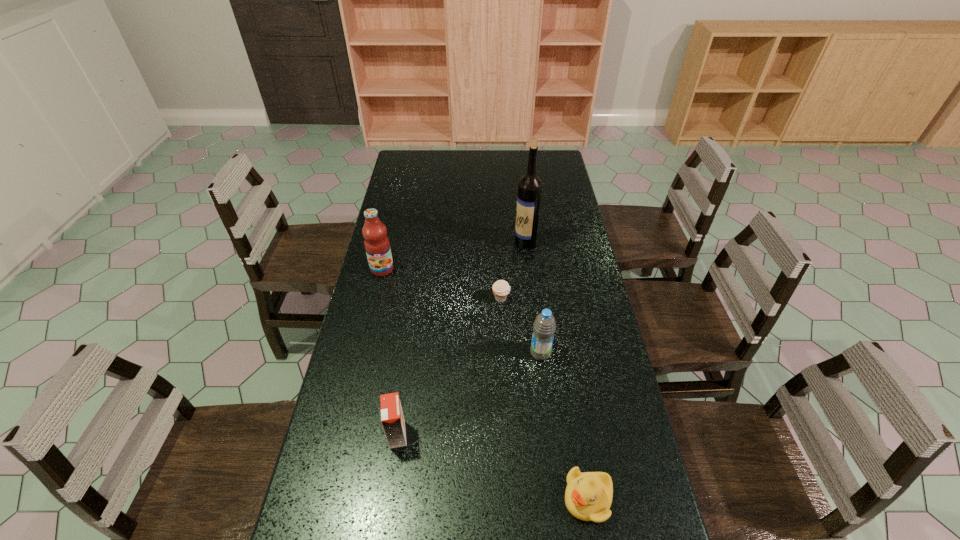
Locate an element on the screen. muffin is located at coordinates (501, 288).

What are the coordinates of `vacant area located 0.070m on the label of the farthest object` in the screenshot? It's located at (495, 242).

At what (x,y) coordinates should I click in order to perform the action: click on vacant space located 0.360m on the label of the farthest object. Please return your answer as a coordinate pair (x, y). The image size is (960, 540). Looking at the image, I should click on (419, 242).

Where is `blank space located 0.060m on the label of the farthest object`? This screenshot has width=960, height=540. blank space located 0.060m on the label of the farthest object is located at coordinates (498, 242).

This screenshot has width=960, height=540. I want to click on vacant region located 0.270m on the front label of the leftmost object, so click(366, 340).

You are a GUI agent. You are given a task and a screenshot of the screen. Output one action in this format:
    pyautogui.click(x=<x>, y=<y>)
    Task: Click on the vacant space located 0.170m on the front of the water bottle
    
    Given the screenshot: What is the action you would take?
    pyautogui.click(x=548, y=416)

Where is `vacant point located on the back of the orange juice`? The width and height of the screenshot is (960, 540). vacant point located on the back of the orange juice is located at coordinates (406, 372).

You are a GUI agent. You are given a task and a screenshot of the screen. Output one action in this format:
    pyautogui.click(x=<x>, y=<y>)
    Task: Click on the free space located 0.170m on the front-facing side of the duckling
    The width and height of the screenshot is (960, 540).
    Given the screenshot: What is the action you would take?
    pyautogui.click(x=489, y=499)

The image size is (960, 540). Find the location of `free location located on the front-facing side of the duckling`. free location located on the front-facing side of the duckling is located at coordinates (436, 499).

At what (x,y) coordinates should I click in order to perform the action: click on vacant region located on the front-facing side of the duckling. Please return your answer as a coordinate pair (x, y). This screenshot has width=960, height=540. Looking at the image, I should click on (533, 499).